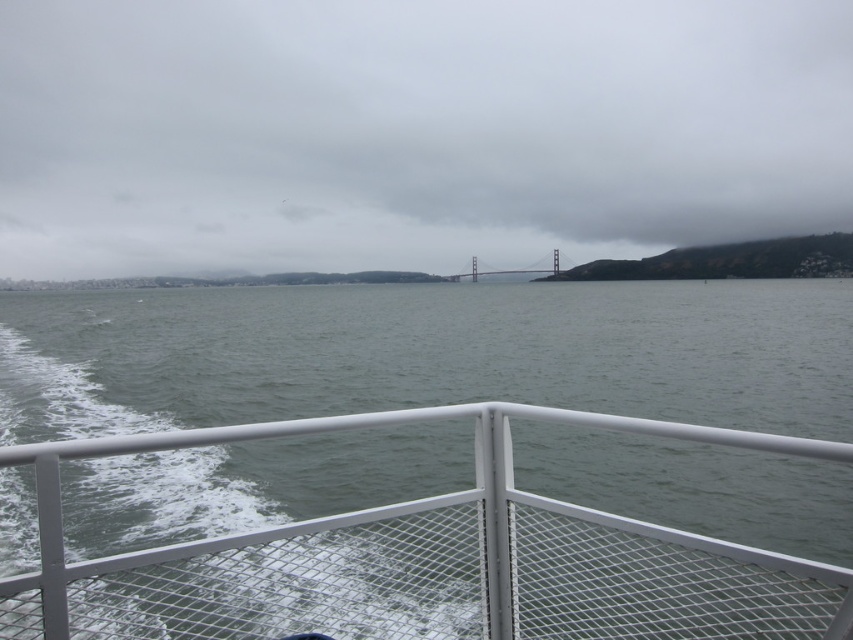
Question: Which of the following is the farthest from the observer?

Choices:
 (A) transparent water at center
 (B) gray water at center

Answer: (A)

Question: Does gray water at center have a lesser width compared to transparent water at center?

Choices:
 (A) yes
 (B) no

Answer: (A)

Question: Which point is farther to the camera?

Choices:
 (A) (599, 403)
 (B) (36, 240)

Answer: (B)

Question: Which point is closer to the camera?

Choices:
 (A) (537, 269)
 (B) (396, 268)

Answer: (B)

Question: Can you confirm if gray water at center is positioned to the right of transparent water at center?

Choices:
 (A) yes
 (B) no

Answer: (B)

Question: Is gray water at center to the right of painted steel bridge at center from the viewer's perspective?

Choices:
 (A) yes
 (B) no

Answer: (B)